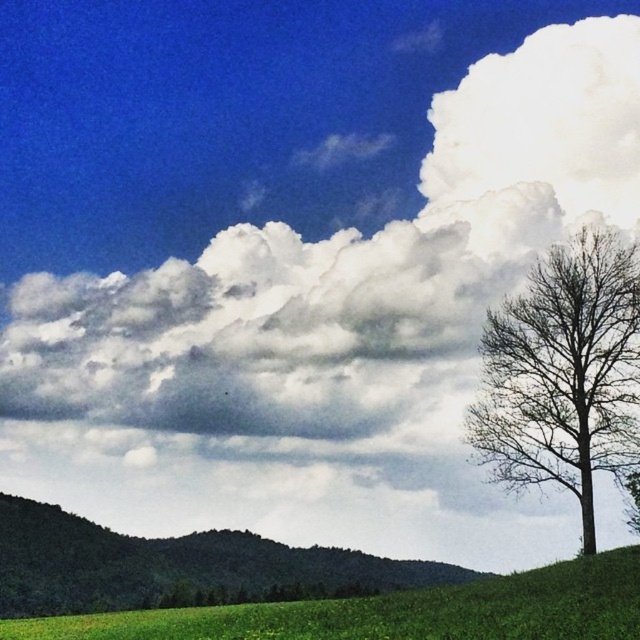
Between bare wood tree at right and green grassy hillside at lower left, which one has more height?

With more height is bare wood tree at right.

Consider the image. Does bare wood tree at right appear on the right side of green grassy hillside at lower left?

Indeed, bare wood tree at right is positioned on the right side of green grassy hillside at lower left.

Who is more distant from viewer, (x=508, y=470) or (x=234, y=564)?

Point (x=234, y=564)

Locate an element on the screen. bare wood tree at right is located at coordinates (563, 372).